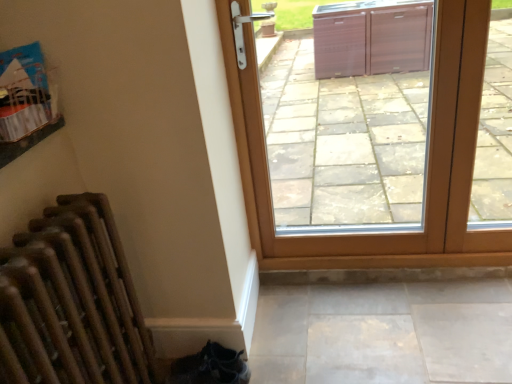
Image resolution: width=512 pixels, height=384 pixels. Identify the location of vacant space situated above wooden radiator at lower left (from a real-world perspective). (42, 234).